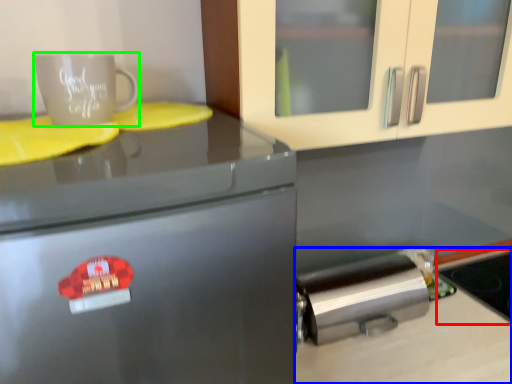
Question: Considering the real-world distances, which object is farthest from appliance (highlighted by a red box)? counter top (highlighted by a blue box) or coffee cup (highlighted by a green box)?

Choices:
 (A) counter top
 (B) coffee cup

Answer: (B)